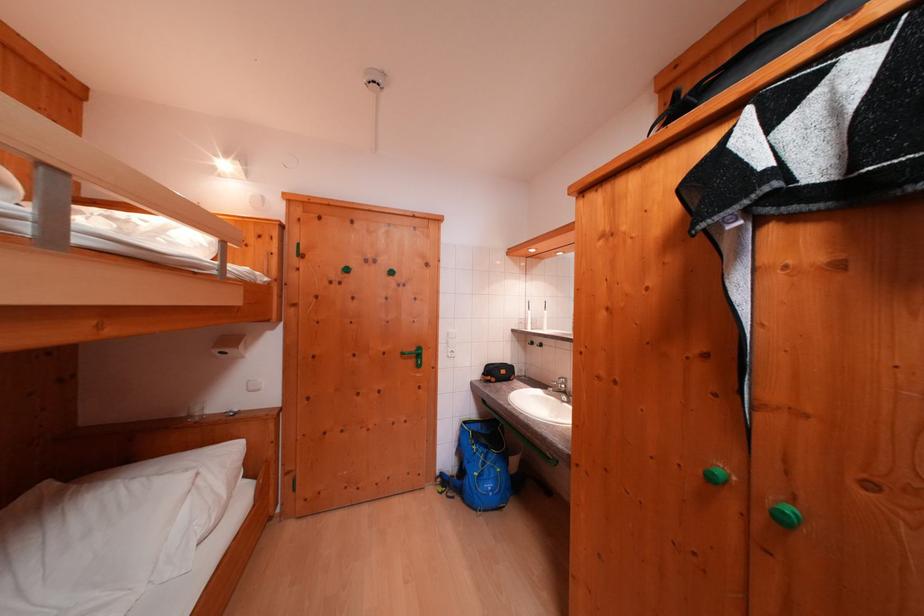
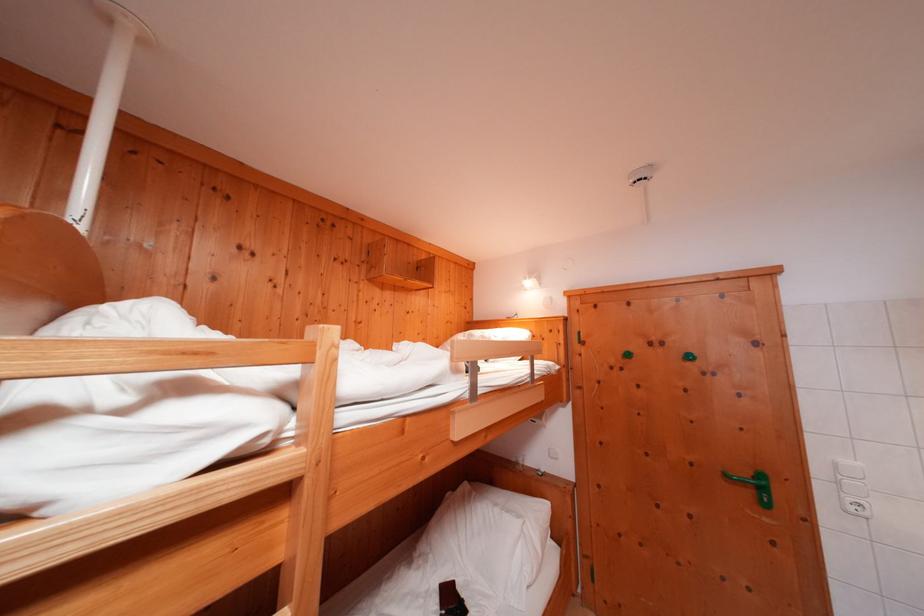
The point at (33,233) is marked in the first image. Where is the corresponding point in the second image?

(476, 399)